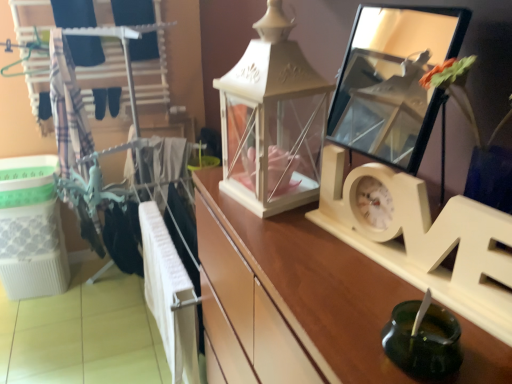
Question: Would you say clear glass mirror at upper right is outside plaid fabric at left?

Choices:
 (A) yes
 (B) no

Answer: (A)

Question: Is clear glass mirror at upper right taller than plaid fabric at left?

Choices:
 (A) no
 (B) yes

Answer: (A)

Question: Is clear glass mirror at upper right closer to camera compared to plaid fabric at left?

Choices:
 (A) yes
 (B) no

Answer: (A)

Question: Does clear glass mirror at upper right turn towards plaid fabric at left?

Choices:
 (A) yes
 (B) no

Answer: (B)

Question: Can you confirm if clear glass mirror at upper right is bigger than plaid fabric at left?

Choices:
 (A) yes
 (B) no

Answer: (B)

Question: Is point (260, 187) positioned closer to the camera than point (372, 276)?

Choices:
 (A) farther
 (B) closer

Answer: (A)

Question: Choose the correct answer: Is white matte lantern at center inside white wood clock at center or outside it?

Choices:
 (A) inside
 (B) outside

Answer: (B)

Question: Considering the positions of white matte lantern at center and white wood clock at center in the image, is white matte lantern at center wider or thinner than white wood clock at center?

Choices:
 (A) thin
 (B) wide

Answer: (B)

Question: From a real-world perspective, is white matte lantern at center physically located above or below white wood clock at center?

Choices:
 (A) below
 (B) above

Answer: (B)

Question: Does point (413, 364) appear closer or farther from the camera than point (248, 268)?

Choices:
 (A) farther
 (B) closer

Answer: (B)

Question: Is green glass candle holder at lower right inside or outside of wooden drawer at center?

Choices:
 (A) outside
 (B) inside

Answer: (A)

Question: Is green glass candle holder at lower right in front of or behind wooden drawer at center in the image?

Choices:
 (A) front
 (B) behind

Answer: (A)

Question: In terms of width, does green glass candle holder at lower right look wider or thinner when compared to wooden drawer at center?

Choices:
 (A) wide
 (B) thin

Answer: (B)

Question: Would you say green glass candle holder at lower right is inside or outside clear glass mirror at upper right?

Choices:
 (A) inside
 (B) outside

Answer: (B)

Question: Relative to clear glass mirror at upper right, is green glass candle holder at lower right in front or behind?

Choices:
 (A) behind
 (B) front

Answer: (B)